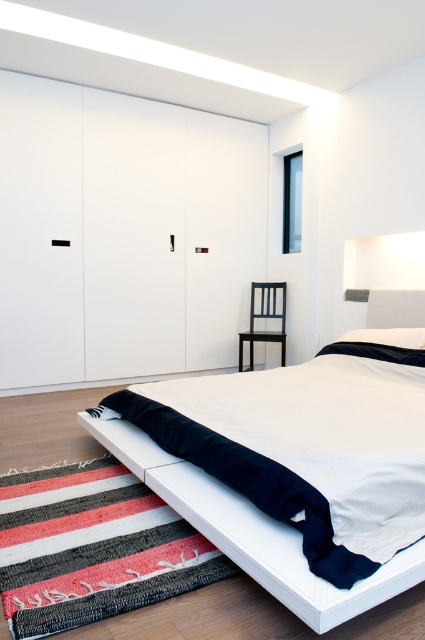
You are organizing a small event in the bedroom and need to place a decorative item. You have a white soft pillow at lower right and a black matte chair at right. Which object should you move to make space for a new lamp that requires placement between them?

The black matte chair at right should be moved because it is positioned on the left side of the white soft pillow at lower right, so moving the chair would create space between them for the lamp.

You are standing in the bedroom and want to sit down. There is a point marked at coordinates (265, 317). What object is located at that point?

The point at coordinates (265, 317) corresponds to the black matte chair at right.